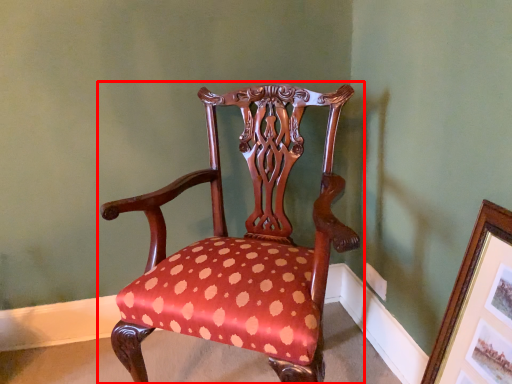
Question: Where is chair (annotated by the red box) located in relation to picture frame in the image?

Choices:
 (A) right
 (B) left

Answer: (B)